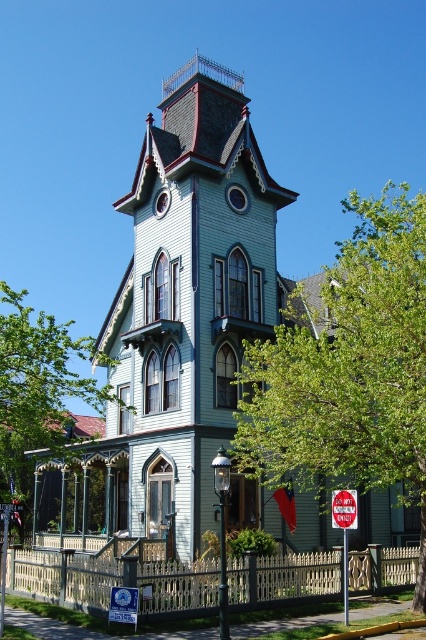
What are the coordinates of the green leafy tree at center in the image?

The green leafy tree at center is located at coordinates point (37,387).

You are standing in front of the Victorian house and want to walk towards the green leafy tree at lower right and the red metal stop sign at center. Which object will you reach first?

You will reach the green leafy tree at lower right first because it is closer to you than the red metal stop sign at center.

You are standing in front of the Victorian house and notice two points marked on its facade. The first point is at coordinate point (423, 433) and the second is at point (337, 508). Which of these two points is closer to your current position?

Point (423, 433) is closer to the viewer than point (337, 508).